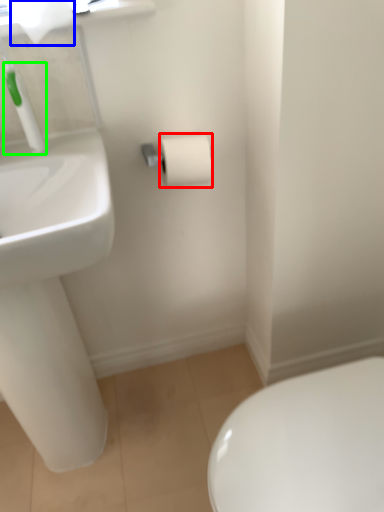
Question: Which is nearer to the toilet paper (highlighted by a red box)? toilet paper (highlighted by a blue box) or plumbing fixture (highlighted by a green box).

Choices:
 (A) toilet paper
 (B) plumbing fixture

Answer: (B)